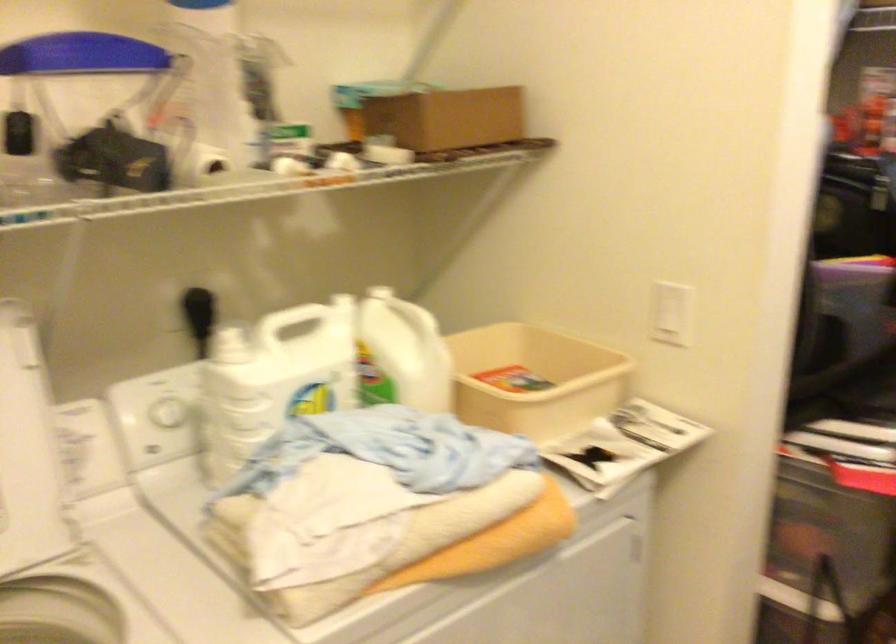
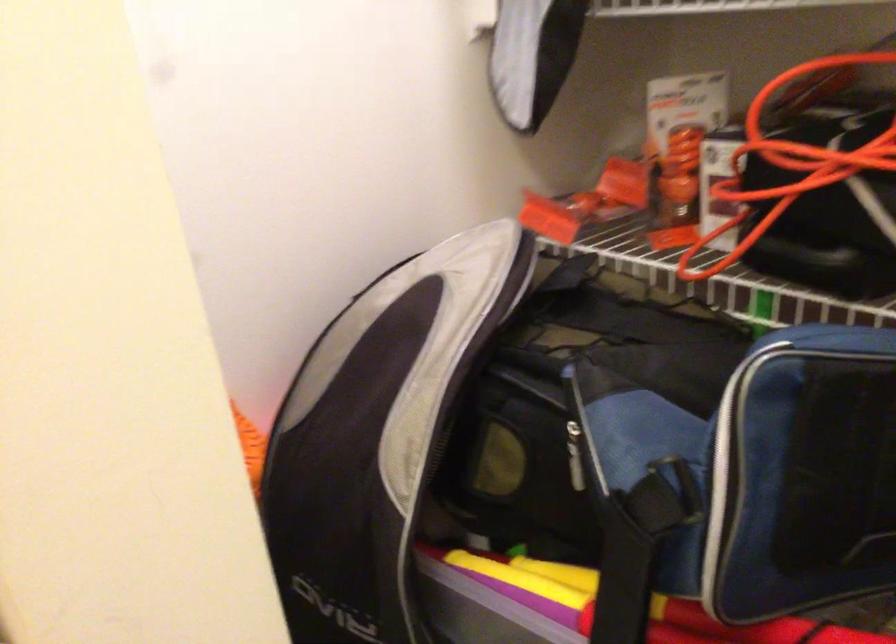
What movement of the cameraman would produce the second image?

The cameraman walked toward right, forward.